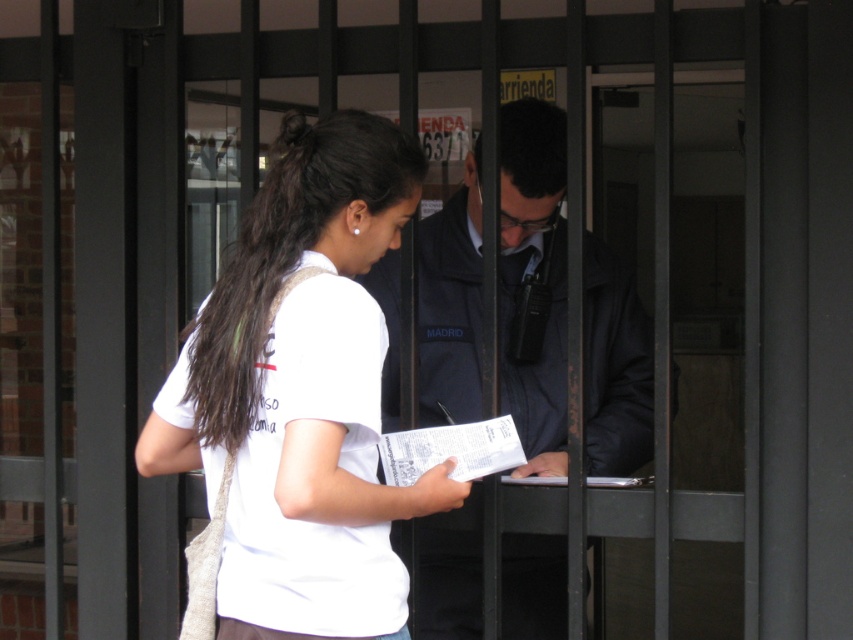
Does white matte shirt at center appear under dark blue uniform at center?

No, white matte shirt at center is not below dark blue uniform at center.

Is white matte shirt at center to the left of dark blue uniform at center from the viewer's perspective?

Correct, you'll find white matte shirt at center to the left of dark blue uniform at center.

What do you see at coordinates (302, 394) in the screenshot?
I see `white matte shirt at center` at bounding box center [302, 394].

Locate an element on the screen. white matte shirt at center is located at coordinates (302, 394).

Describe the element at coordinates (302, 394) in the screenshot. I see `white matte shirt at center` at that location.

Between white matte shirt at center and dark brown hair at center, which one appears on the left side from the viewer's perspective?

Positioned to the left is dark brown hair at center.

Locate an element on the screen. Image resolution: width=853 pixels, height=640 pixels. white matte shirt at center is located at coordinates (302, 394).

Can you confirm if dark blue uniform at center is wider than dark brown hair at center?

Indeed, dark blue uniform at center has a greater width compared to dark brown hair at center.

The image size is (853, 640). Find the location of `dark blue uniform at center`. dark blue uniform at center is located at coordinates (531, 275).

Identify the location of dark blue uniform at center. tap(531, 275).